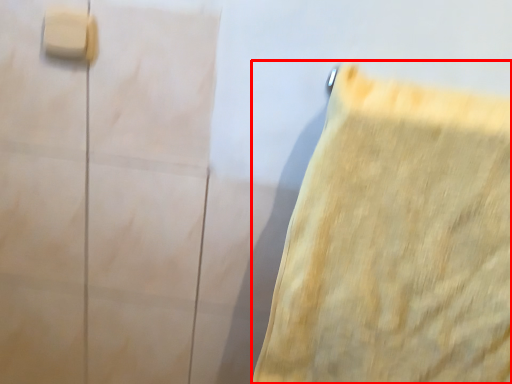
Question: In this image, where is towel (annotated by the red box) located relative to light switch?

Choices:
 (A) left
 (B) right

Answer: (B)